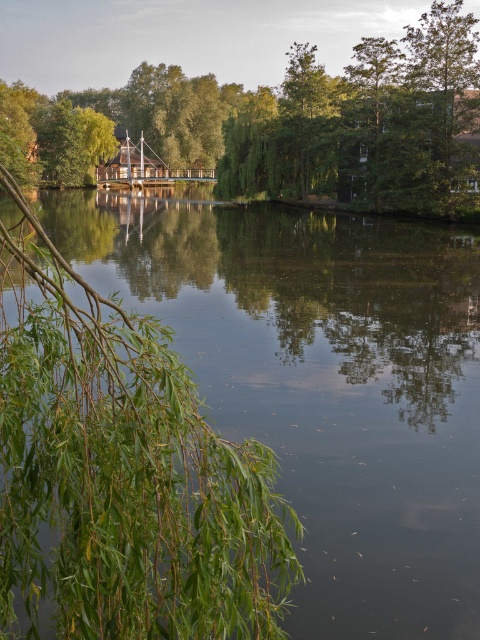
Question: Where is green leafy branches at lower left located in relation to green leafy tree at center in the image?

Choices:
 (A) below
 (B) above

Answer: (A)

Question: Which point is closer to the camera?

Choices:
 (A) green leafy branches at lower left
 (B) green leafy tree at center

Answer: (A)

Question: Does green leafy branches at lower left have a greater width compared to green leafy tree at center?

Choices:
 (A) no
 (B) yes

Answer: (A)

Question: Which point is closer to the camera?

Choices:
 (A) green leafy tree at center
 (B) green leafy branches at lower left

Answer: (B)

Question: Does green leafy branches at lower left appear on the left side of green leafy tree at center?

Choices:
 (A) no
 (B) yes

Answer: (B)

Question: Which of the following is the farthest from the observer?

Choices:
 (A) green leafy branches at lower left
 (B) green leafy tree at center

Answer: (B)